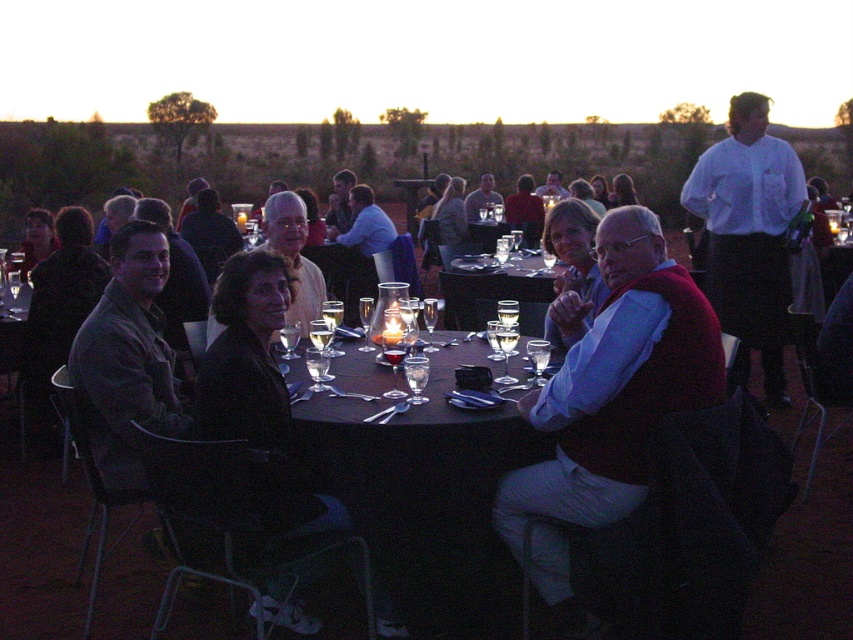
Question: Can you confirm if matte red vest at center is wider than white shirt at upper right?

Choices:
 (A) no
 (B) yes

Answer: (B)

Question: Which object is closer to the camera taking this photo?

Choices:
 (A) matte red vest at center
 (B) white shirt at upper right

Answer: (A)

Question: Considering the relative positions of matte red vest at center and white shirt at upper right in the image provided, where is matte red vest at center located with respect to white shirt at upper right?

Choices:
 (A) left
 (B) right

Answer: (A)

Question: Is matte red vest at center to the left of white shirt at upper right from the viewer's perspective?

Choices:
 (A) no
 (B) yes

Answer: (B)